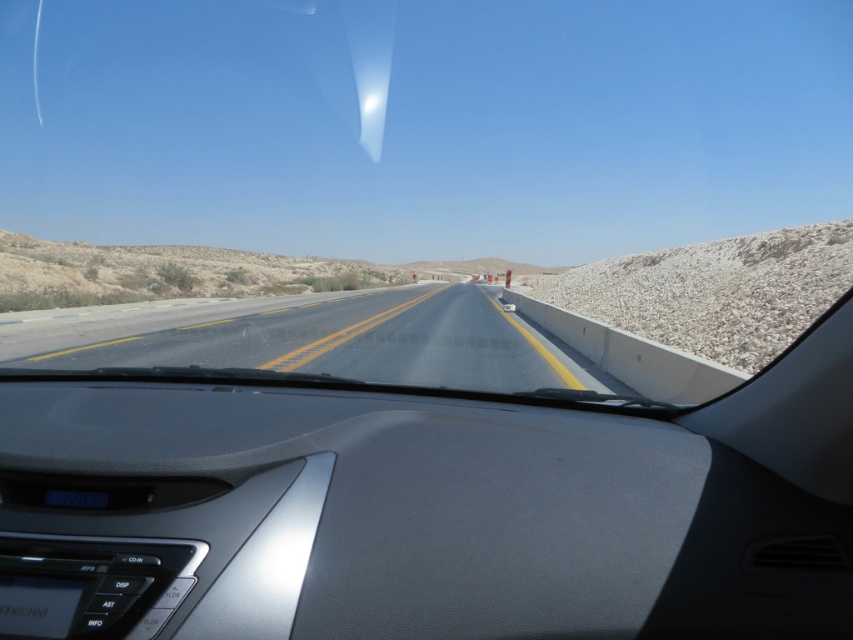
Question: Among these objects, which one is farthest from the camera?

Choices:
 (A) smooth asphalt highway at center
 (B) white gravel at right

Answer: (B)

Question: Is smooth asphalt highway at center wider than white gravel at right?

Choices:
 (A) yes
 (B) no

Answer: (A)

Question: Where is smooth asphalt highway at center located in relation to white gravel at right in the image?

Choices:
 (A) above
 (B) below

Answer: (B)

Question: Which point is farther to the camera?

Choices:
 (A) smooth asphalt highway at center
 (B) white gravel at right

Answer: (B)

Question: Does smooth asphalt highway at center have a larger size compared to white gravel at right?

Choices:
 (A) yes
 (B) no

Answer: (B)